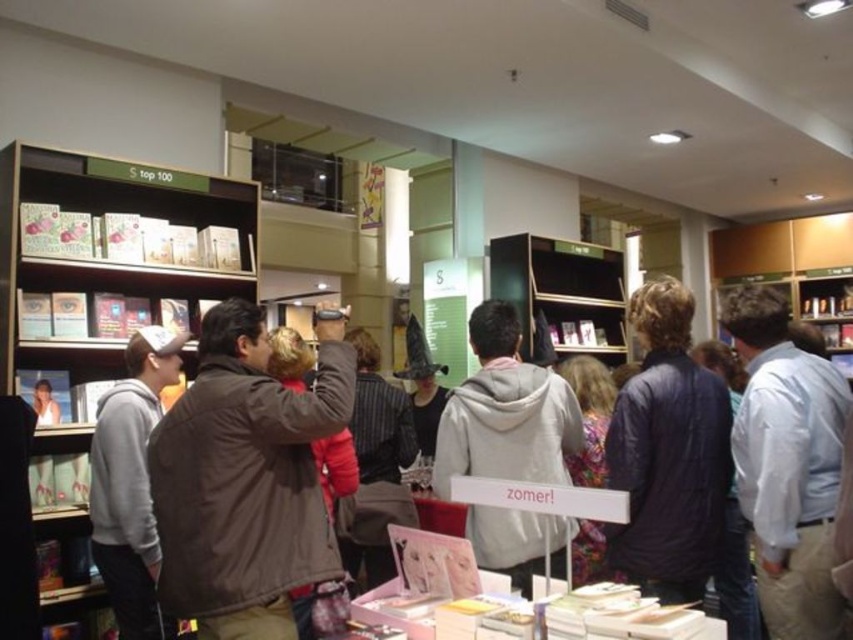
You are a customer in the bookstore and see both the light blue shirt at center and the striped fabric jacket at center. Which one is positioned more to the right?

The light blue shirt at center is positioned more to the right than the striped fabric jacket at center.

Based on the photo, you are a store employee who needs to reach a book on the top shelf. You see a light blue shirt at center and a striped fabric jacket at center. Which clothing item is shorter and thus more likely to be worn by someone who can reach the top shelf without a ladder?

The light blue shirt at center is shorter than the striped fabric jacket at center, so the person wearing the light blue shirt at center is more likely to be able to reach the top shelf without a ladder.

In the scene shown: You are a customer in the bookstore and want to reach the metallic silver bookshelf at center from the wooden bookshelf at left. Which direction should you move?

The wooden bookshelf at left is to the left of the metallic silver bookshelf at center, so you should move to the right to reach the metallic silver bookshelf at center.